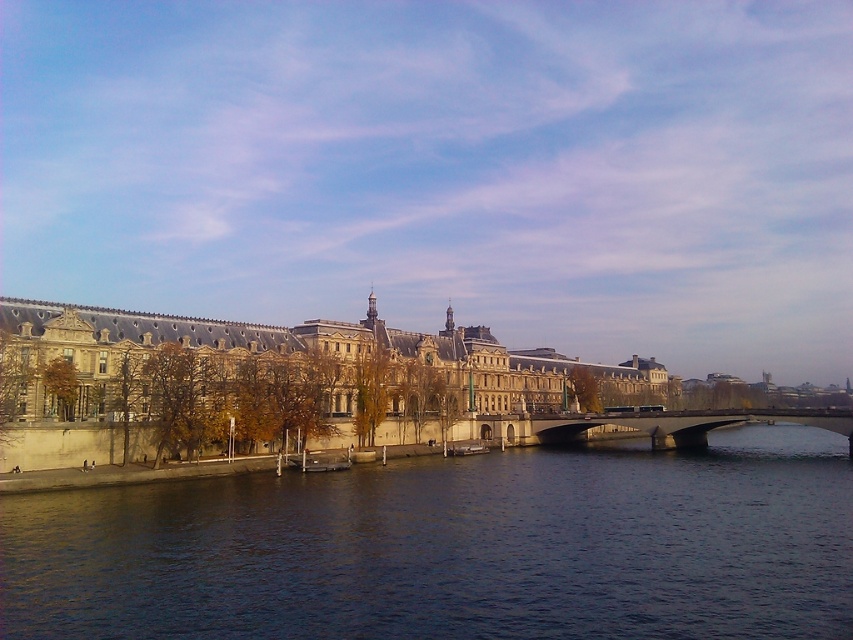
You are an architect assessing the riverside area. You need to determine which of the two elements, the dark blue water at center or the stone building at center, occupies a larger area in the scene. Based on the provided information, which one is bigger?

The stone building at center is larger than the dark blue water at center.

You are a boat captain planning to navigate a boat that is 10 meters wide through the river shown in the image. You see the dark blue water at center and the concrete bridge at center. Can your boat pass under the bridge without touching it?

The dark blue water at center might be wider than concrete bridge at center, so there is a possibility that the boat can pass under the bridge if the water width is sufficient. However, the exact dimensions are uncertain based on the provided information.

You are a boat captain navigating a small boat on the dark blue water at center. There is a safety regulation stating that boats must maintain a minimum distance of 30 meters from the stone embankment to avoid collisions. Is your current position compliant with this regulation?

The distance between the dark blue water at center and the stone embankment is 40.80 meters, which exceeds the required 30 meters. Therefore, the boat is compliant with the safety regulation.